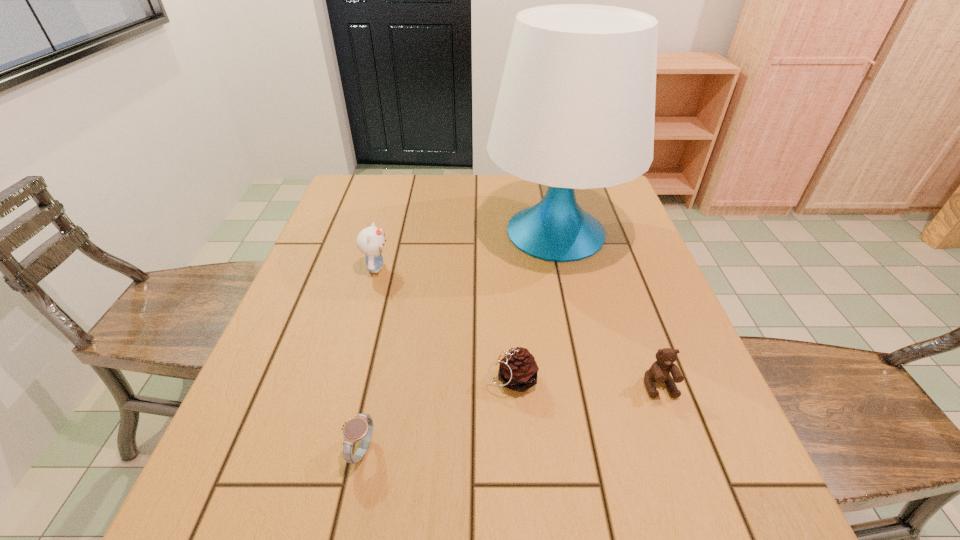
Locate an element on the screen. Image resolution: width=960 pixels, height=540 pixels. vacant area situated 0.320m with a leaf charm attached to the pinecone is located at coordinates (325, 379).

The width and height of the screenshot is (960, 540). I want to click on vacant position located with a leaf charm attached to the pinecone, so click(x=392, y=379).

This screenshot has height=540, width=960. I want to click on vacant space located with a leaf charm attached to the pinecone, so [381, 379].

I want to click on vacant area situated on the back of the nearest object, so pos(381,358).

Locate an element on the screen. object that is at the far edge is located at coordinates (576, 107).

The height and width of the screenshot is (540, 960). In order to click on object that is at the left edge in this screenshot , I will do `click(370, 241)`.

Find the location of a particular element. The width and height of the screenshot is (960, 540). table lamp that is positioned at the right edge is located at coordinates (576, 107).

What are the coordinates of `teddy bear situated at the right edge` in the screenshot? It's located at (659, 372).

Locate an element on the screen. The width and height of the screenshot is (960, 540). object that is positioned at the far right corner is located at coordinates (576, 107).

Find the location of a particular element. The height and width of the screenshot is (540, 960). vacant space at the far edge of the desktop is located at coordinates pos(480,193).